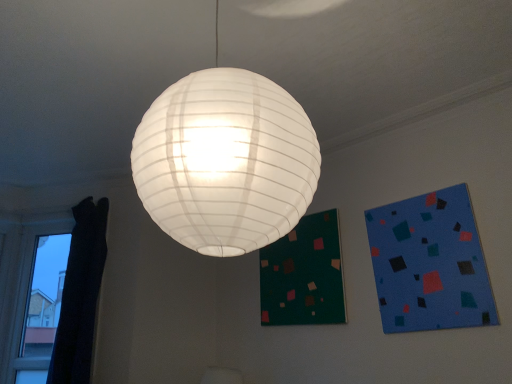
Question: From the image's perspective, is blue matte square at upper right located beneath dark green fabric bulletin board at lower center?

Choices:
 (A) yes
 (B) no

Answer: (B)

Question: Is dark green fabric bulletin board at lower center completely or partially inside blue matte square at upper right?

Choices:
 (A) no
 (B) yes

Answer: (A)

Question: Is blue matte square at upper right positioned with its back to dark green fabric bulletin board at lower center?

Choices:
 (A) no
 (B) yes

Answer: (A)

Question: Can you confirm if blue matte square at upper right is wider than dark green fabric bulletin board at lower center?

Choices:
 (A) no
 (B) yes

Answer: (A)

Question: Can you confirm if blue matte square at upper right is bigger than dark green fabric bulletin board at lower center?

Choices:
 (A) yes
 (B) no

Answer: (B)

Question: Considering the relative positions of blue matte square at upper right and dark green fabric bulletin board at lower center in the image provided, is blue matte square at upper right to the left of dark green fabric bulletin board at lower center from the viewer's perspective?

Choices:
 (A) yes
 (B) no

Answer: (B)

Question: Is black curtain at left taller than dark green fabric bulletin board at lower center?

Choices:
 (A) no
 (B) yes

Answer: (B)

Question: From the image's perspective, does black curtain at left appear higher than dark green fabric bulletin board at lower center?

Choices:
 (A) yes
 (B) no

Answer: (B)

Question: Is dark green fabric bulletin board at lower center a part of black curtain at left?

Choices:
 (A) yes
 (B) no

Answer: (B)

Question: Considering the relative positions of black curtain at left and dark green fabric bulletin board at lower center in the image provided, is black curtain at left behind dark green fabric bulletin board at lower center?

Choices:
 (A) yes
 (B) no

Answer: (A)

Question: From the image's perspective, would you say black curtain at left is shown under dark green fabric bulletin board at lower center?

Choices:
 (A) yes
 (B) no

Answer: (A)

Question: Is black curtain at left aimed at dark green fabric bulletin board at lower center?

Choices:
 (A) no
 (B) yes

Answer: (A)

Question: Does black curtain at left appear on the left side of blue matte square at upper right?

Choices:
 (A) yes
 (B) no

Answer: (A)